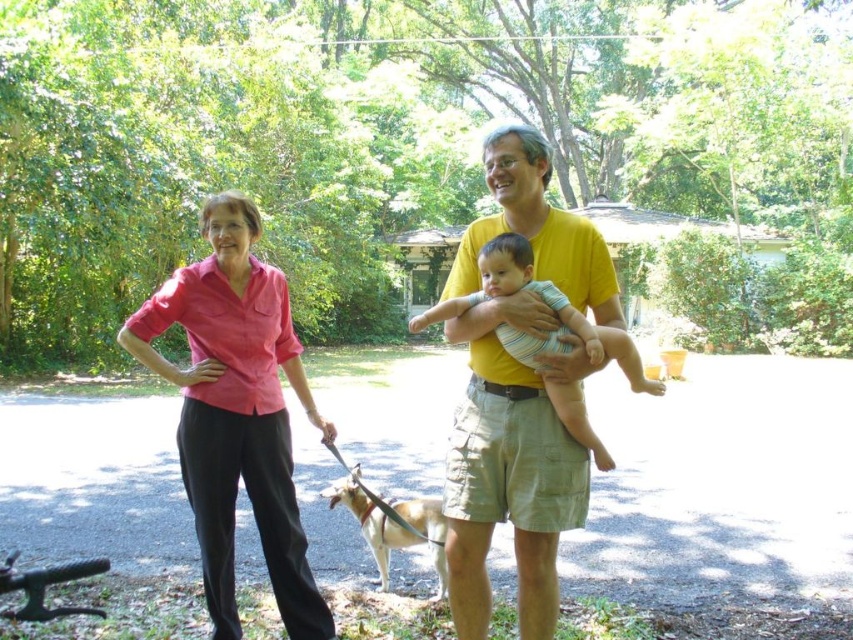
Is yellow cotton shirt at center positioned in front of light brown fur at lower center?

Yes.

Is point (473, 308) positioned before point (434, 508)?

Yes, point (473, 308) is in front of point (434, 508).

Is point (599, 292) positioned before point (416, 532)?

Yes, it is in front of point (416, 532).

Identify the location of yellow cotton shirt at center. (509, 467).

Is point (589, 220) positioned in front of point (181, 285)?

That is True.

Between point (474, 262) and point (270, 444), which one is positioned in front?

Positioned in front is point (474, 262).

Is point (573, 506) closer to camera compared to point (215, 365)?

Yes, it is.

Locate an element on the screen. This screenshot has width=853, height=640. yellow cotton shirt at center is located at coordinates (509, 467).

Does yellow cotton shirt at center have a lesser width compared to striped cotton baby at center?

Incorrect, yellow cotton shirt at center's width is not less than striped cotton baby at center's.

Is yellow cotton shirt at center behind striped cotton baby at center?

Yes, yellow cotton shirt at center is behind striped cotton baby at center.

Who is more forward, (456,445) or (540,368)?

Point (540,368)

Locate an element on the screen. This screenshot has width=853, height=640. yellow cotton shirt at center is located at coordinates point(509,467).